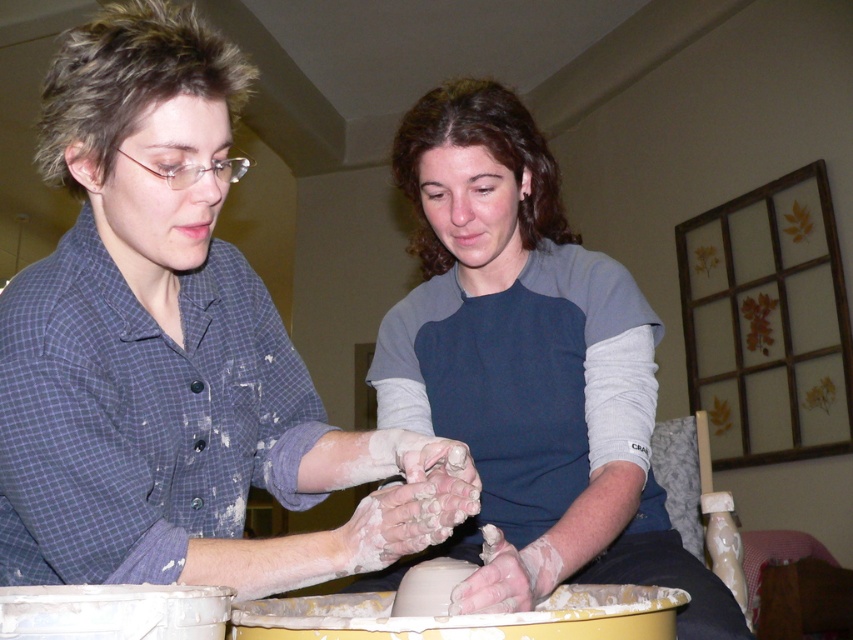
You are a photographer standing 6 feet away from the two people in the image. You want to take a photo that includes both the matte gray shirt at center and the blue fabric shirt at center. Can you fit both shirts into the frame of your camera without zooming in or moving closer?

The matte gray shirt at center and blue fabric shirt at center are 14.05 inches apart from each other. Since the photographer is 6 feet away, the distance between the shirts is likely within the camera frame without needing to zoom or move closer.

Based on the scene description, which individual is shorter in height between the person wearing the matte gray shirt at center and the one in the blue fabric shirt at center?

The matte gray shirt at center has a lesser height compared to the blue fabric shirt at center, so the person wearing the matte gray shirt at center is shorter.